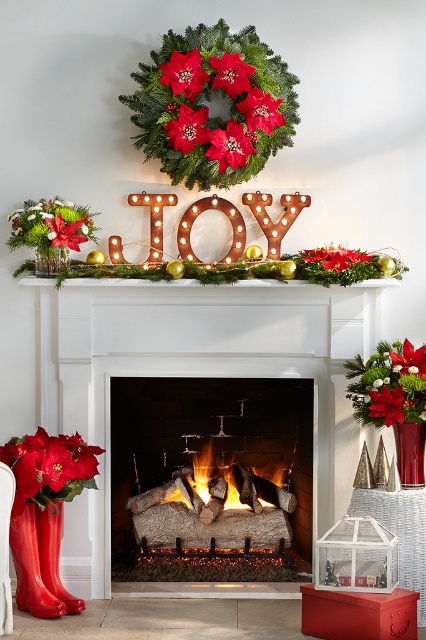
In the scene shown: You are a guest at a Christmas party and want to place a small gift under the mantel. The gift requires a space that is taller than the glossy rubber boots at lower left. Can the wooden logs at center provide enough height for the gift?

The wooden logs at center is taller than the glossy rubber boots at lower left, so yes, the wooden logs at center can provide enough height for the gift.